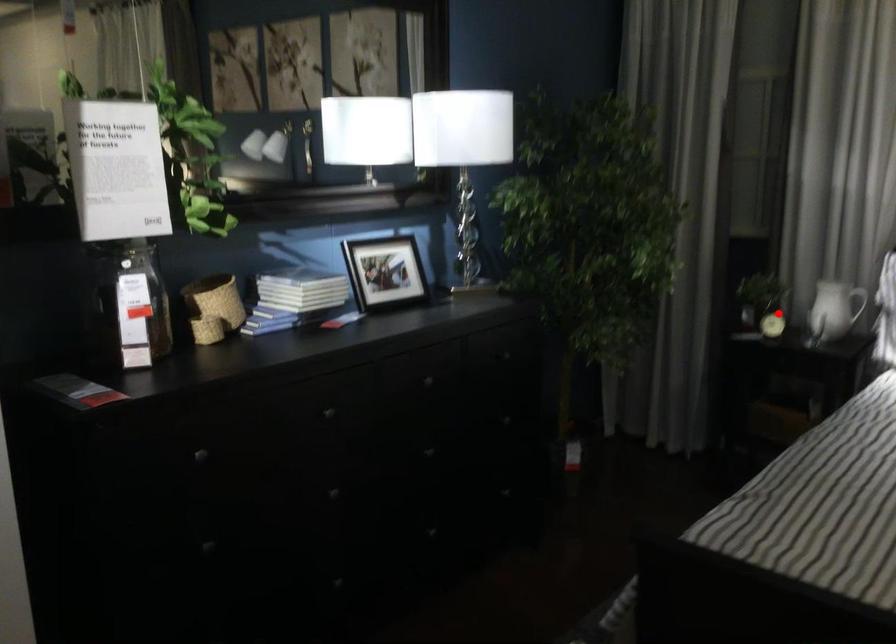
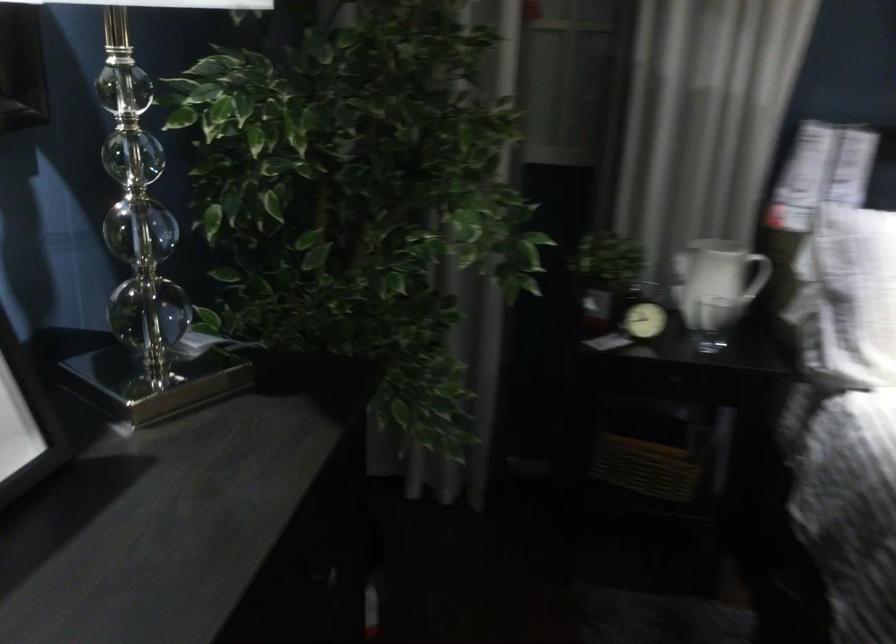
Question: I am providing you with two images of the same scene from different viewpoints. In image1, a red point is highlighted. Considering the same 3D point in image2, which of the following is correct?

Choices:
 (A) It is closer
 (B) It is farther

Answer: (A)